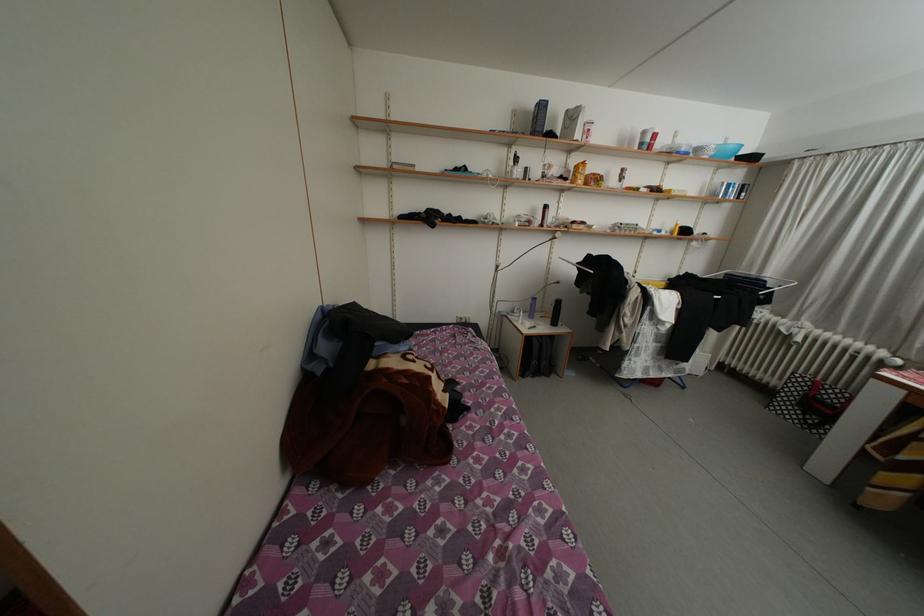
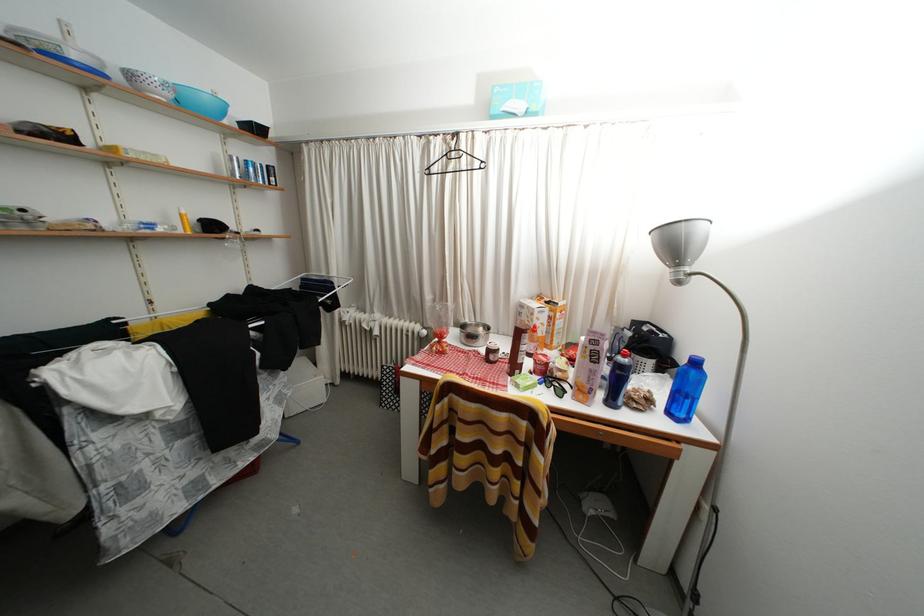
The point at [691,154] is marked in the first image. Where is the corresponding point in the second image?

(81, 61)